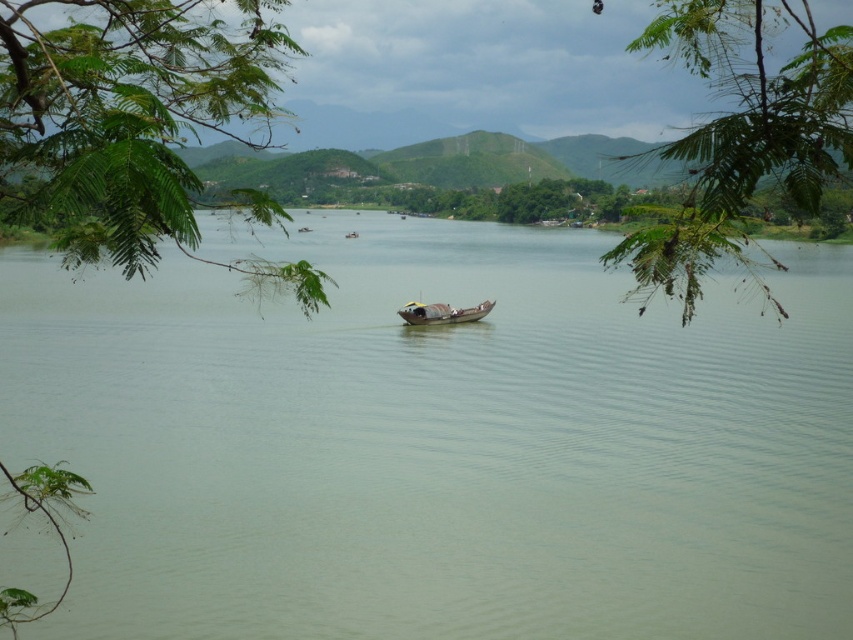
Can you confirm if green leafy branch at upper left is shorter than green leafy branch at upper center?

Correct, green leafy branch at upper left is not as tall as green leafy branch at upper center.

Which is in front, point (218, 19) or point (694, 52)?

Positioned in front is point (694, 52).

Which is behind, point (119, 0) or point (811, 33)?

Point (119, 0)

Identify the location of green leafy branch at upper left. The height and width of the screenshot is (640, 853). (136, 128).

Who is lower down, green matte water at center or rusty metal boat at center?

rusty metal boat at center is lower down.

Who is more distant from viewer, (328,476) or (437,305)?

Positioned behind is point (437,305).

Who is more forward, (213, 304) or (401, 314)?

Point (401, 314)

Where is `green matte water at center`? green matte water at center is located at coordinates (438, 442).

In the scene shown: Can you confirm if green matte water at center is positioned below green leafy branch at upper left?

Yes.

What are the coordinates of `green matte water at center` in the screenshot? It's located at (438, 442).

The image size is (853, 640). In order to click on green matte water at center in this screenshot , I will do `click(438, 442)`.